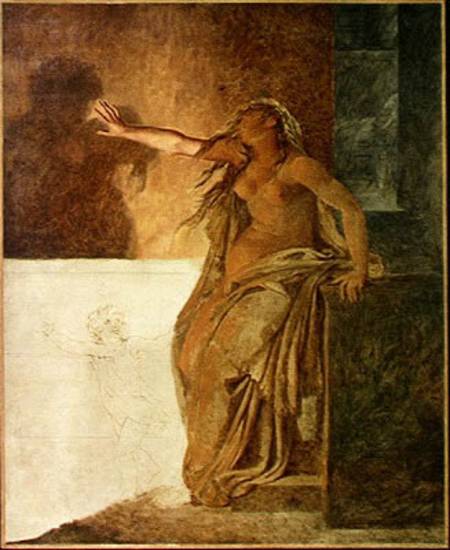
Find the location of a particular element. This screenshot has width=450, height=550. upper brown wall is located at coordinates (173, 37), (260, 46).